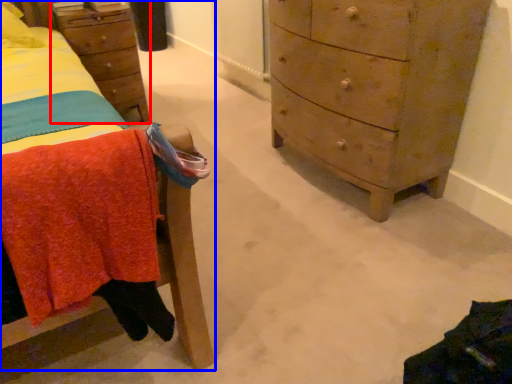
Question: Which object is further to the camera taking this photo, nightstand (highlighted by a red box) or furniture (highlighted by a blue box)?

Choices:
 (A) nightstand
 (B) furniture

Answer: (A)